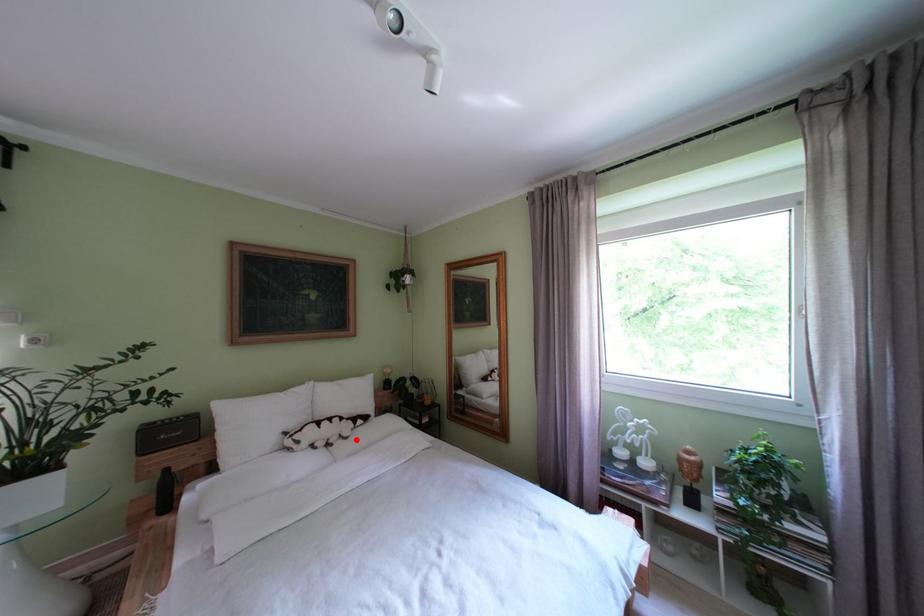
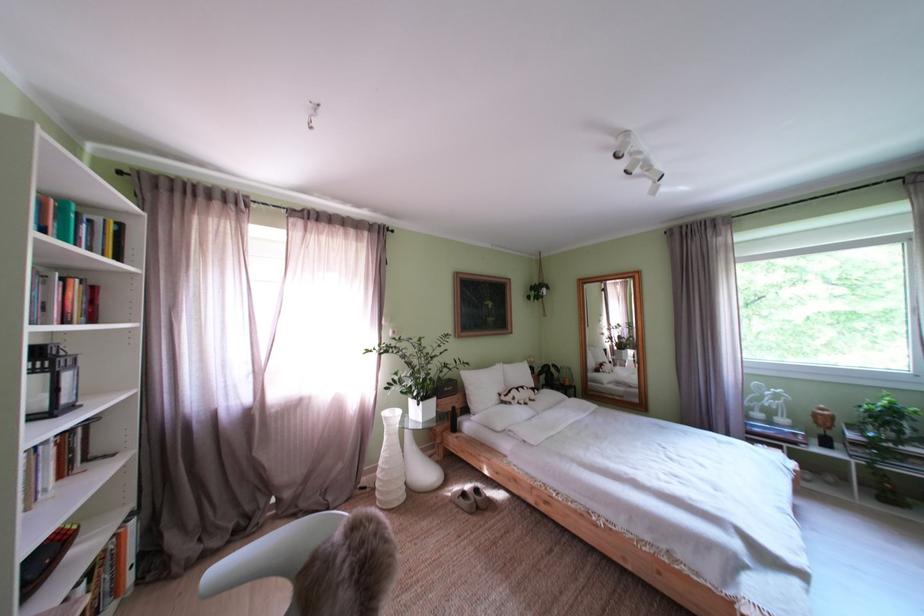
Find the pixel in the second image that matches the highlighted location in the first image.

(543, 403)